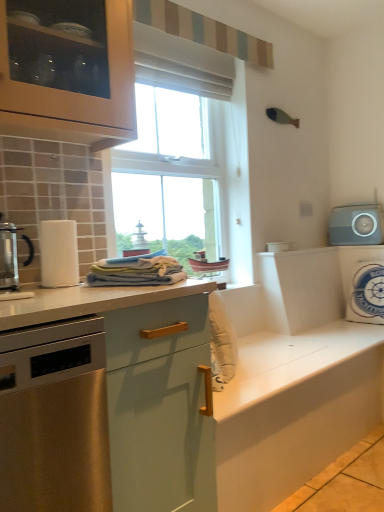
Question: Can you confirm if metallic glass coffee maker at left is smaller than stainless steel dishwasher at left?

Choices:
 (A) no
 (B) yes

Answer: (B)

Question: Can you confirm if metallic glass coffee maker at left is wider than stainless steel dishwasher at left?

Choices:
 (A) yes
 (B) no

Answer: (B)

Question: Considering the relative sizes of metallic glass coffee maker at left and stainless steel dishwasher at left in the image provided, is metallic glass coffee maker at left bigger than stainless steel dishwasher at left?

Choices:
 (A) no
 (B) yes

Answer: (A)

Question: Is stainless steel dishwasher at left completely or partially inside metallic glass coffee maker at left?

Choices:
 (A) no
 (B) yes

Answer: (A)

Question: From the image's perspective, would you say metallic glass coffee maker at left is shown under stainless steel dishwasher at left?

Choices:
 (A) yes
 (B) no

Answer: (B)

Question: Is metallic glass coffee maker at left aimed at stainless steel dishwasher at left?

Choices:
 (A) yes
 (B) no

Answer: (B)

Question: Can we say matte white countertop at center lies outside gray matte speaker at upper right, which is the third appliance from bottom to top?

Choices:
 (A) yes
 (B) no

Answer: (A)

Question: Does matte white countertop at center turn towards gray matte speaker at upper right, which is the 1th appliance in right-to-left order?

Choices:
 (A) yes
 (B) no

Answer: (B)

Question: Can you confirm if matte white countertop at center is wider than gray matte speaker at upper right, which ranks as the third appliance in left-to-right order?

Choices:
 (A) yes
 (B) no

Answer: (A)

Question: Does matte white countertop at center have a lesser height compared to gray matte speaker at upper right, which ranks as the third appliance in left-to-right order?

Choices:
 (A) no
 (B) yes

Answer: (A)

Question: Does matte white countertop at center have a smaller size compared to gray matte speaker at upper right, which is the 1th appliance in right-to-left order?

Choices:
 (A) no
 (B) yes

Answer: (A)

Question: Does matte white countertop at center have a larger size compared to gray matte speaker at upper right, which is the third appliance from bottom to top?

Choices:
 (A) no
 (B) yes

Answer: (B)

Question: Is metallic glass coffee maker at left thinner than white matte cabinet at center?

Choices:
 (A) no
 (B) yes

Answer: (B)